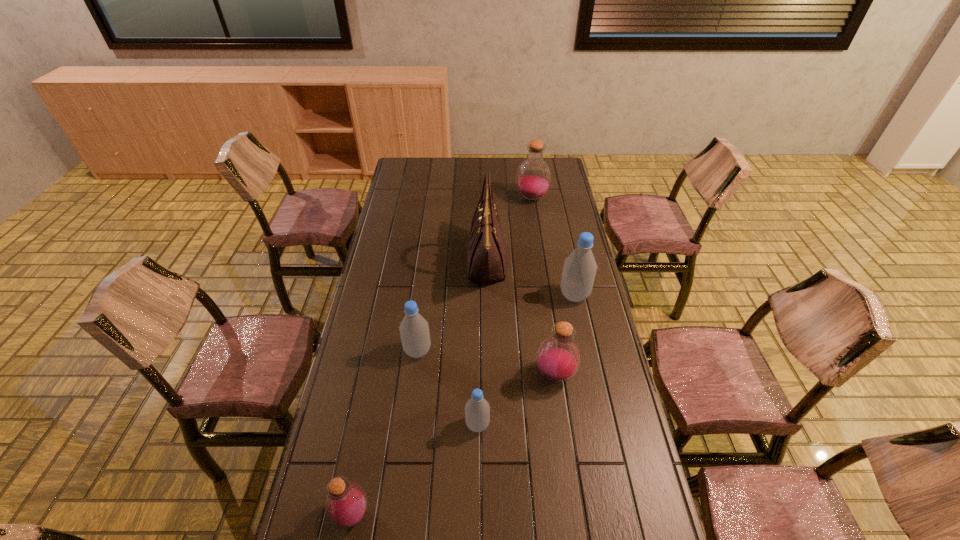
The height and width of the screenshot is (540, 960). I want to click on the nearest purple bottle, so click(x=346, y=503).

Locate an element on the screen. The image size is (960, 540). the leftmost purple bottle is located at coordinates (346, 503).

This screenshot has width=960, height=540. I want to click on vacant space located 0.190m on the front-facing side of the handbag, so click(422, 261).

At what (x,y) coordinates should I click in order to perform the action: click on free spot located 0.350m on the front-facing side of the handbag. Please return your answer as a coordinate pair (x, y). Image resolution: width=960 pixels, height=540 pixels. Looking at the image, I should click on (384, 261).

At what (x,y) coordinates should I click in order to perform the action: click on vacant space positioned on the front-facing side of the handbag. Please return your answer as a coordinate pair (x, y). The image size is (960, 540). Looking at the image, I should click on (377, 261).

The width and height of the screenshot is (960, 540). I want to click on vacant point located on the front of the farthest gray bottle, so click(x=585, y=345).

The image size is (960, 540). I want to click on free space located on the front of the farthest bottle, so click(x=535, y=222).

The height and width of the screenshot is (540, 960). Find the location of `vacant space positioned 0.210m on the front of the second farthest purple bottle`. vacant space positioned 0.210m on the front of the second farthest purple bottle is located at coordinates (567, 457).

Identify the location of free space located on the right of the second nearest gray bottle. (452, 351).

At what (x,y) coordinates should I click in order to perform the action: click on free space located 0.140m on the left of the smallest gray bottle. Please return your answer as a coordinate pair (x, y). The image size is (960, 540). Looking at the image, I should click on (420, 424).